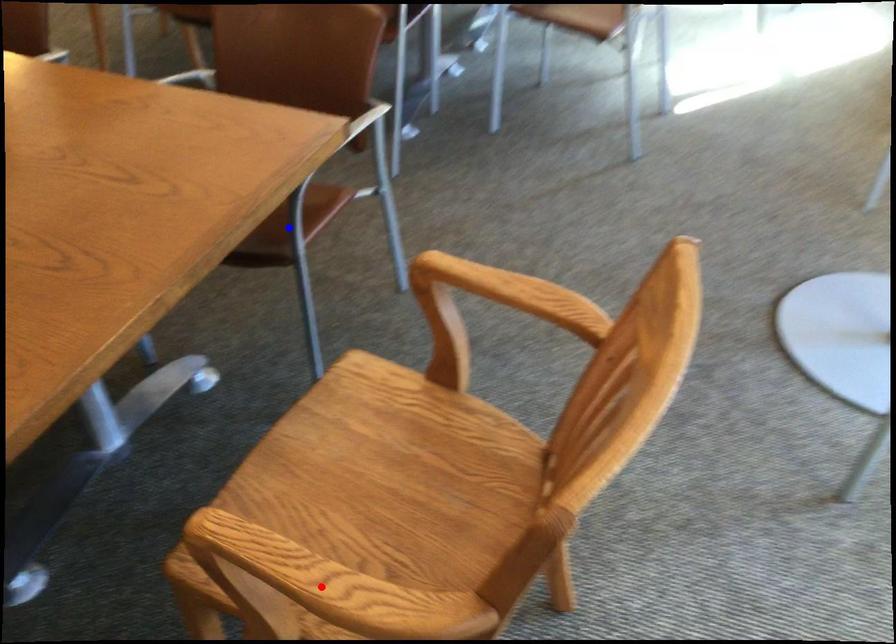
Question: Two points are marked on the image. Which point is closer to the camera?

Choices:
 (A) Blue point is closer.
 (B) Red point is closer.

Answer: (B)